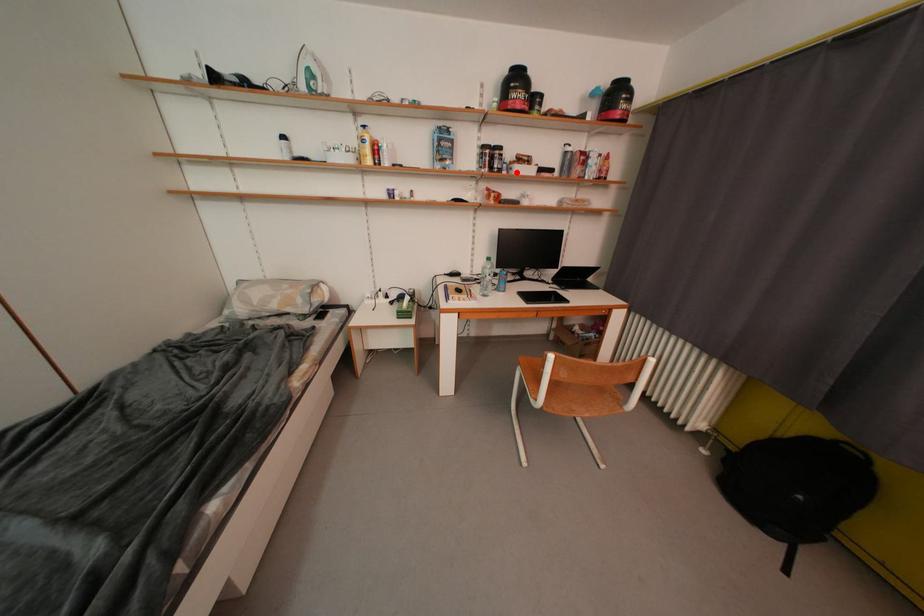
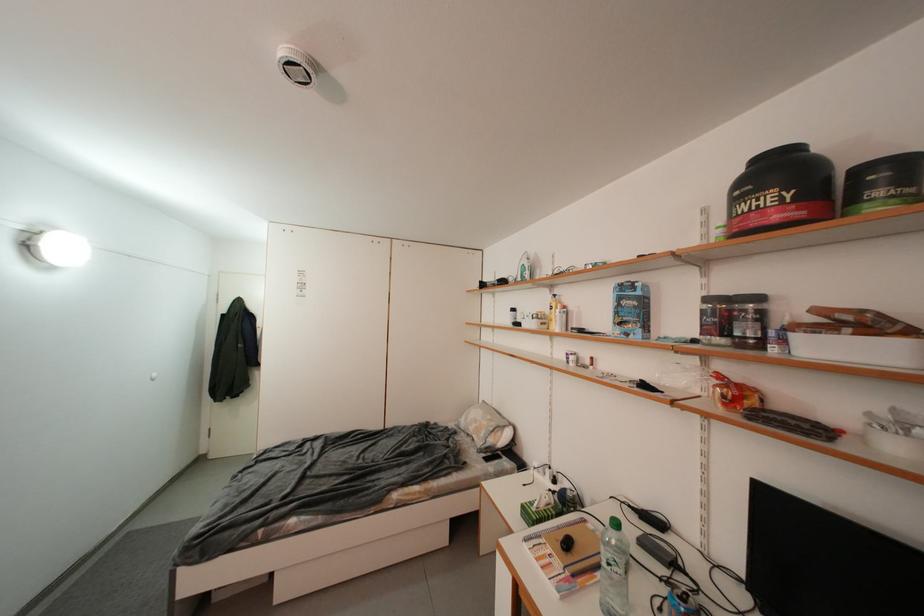
Where in the second image is the point corresponding to the highlighted location from the first image?

(792, 345)